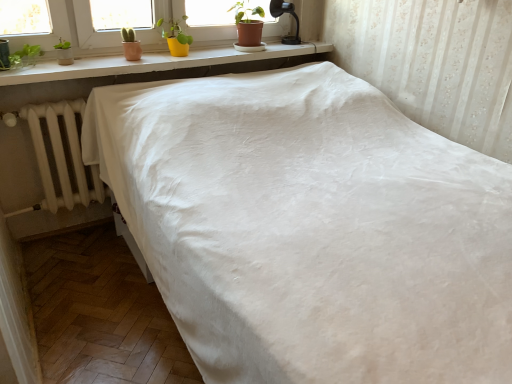
Question: From their relative heights in the image, would you say white fabric bed at center is taller or shorter than black glass lamp at upper right?

Choices:
 (A) short
 (B) tall

Answer: (B)

Question: Is white fabric bed at center inside the boundaries of black glass lamp at upper right, or outside?

Choices:
 (A) outside
 (B) inside

Answer: (A)

Question: Estimate the real-world distances between objects in this image. Which object is closer to the white painted wood at upper center?

Choices:
 (A) black glass lamp at upper right
 (B) matte brown pot at upper center, the 1th houseplant viewed from the right
 (C) white matte radiator at left
 (D) yellow matte pot at upper center, which is the second houseplant in right-to-left order
 (E) white fabric bed at center

Answer: (D)

Question: Which object is the closest to the white matte radiator at left?

Choices:
 (A) yellow matte pot at upper center, which is the second houseplant in right-to-left order
 (B) white painted wood at upper center
 (C) black glass lamp at upper right
 (D) white fabric bed at center
 (E) matte brown pot at upper center, the second houseplant when ordered from left to right

Answer: (B)